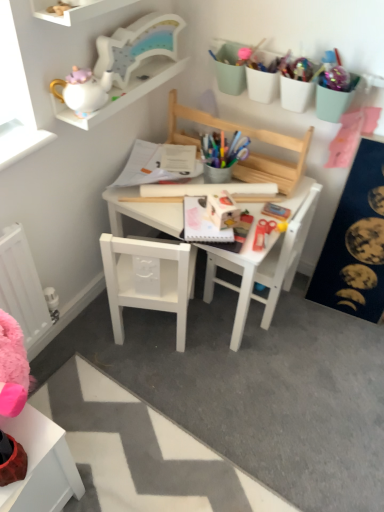
Find the location of a particular element. This screenshot has height=512, width=384. free point to the left of white matte chair at lower left, placed as the 2th chair when sorted from right to left is located at coordinates (86, 336).